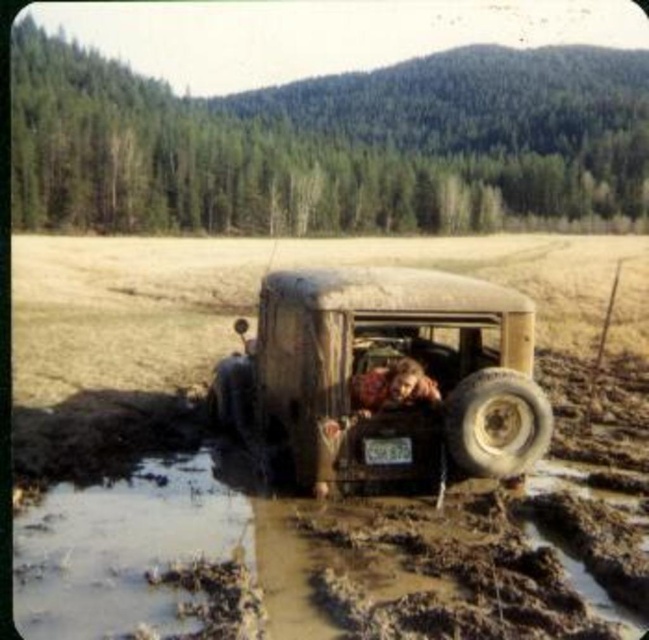
Which is above, light brown rubber tire at lower right or brown leather jacket at rear center?

brown leather jacket at rear center is above.

Find the location of a particular element. light brown rubber tire at lower right is located at coordinates (496, 422).

Between point (474, 403) and point (373, 381), which one is positioned behind?

Point (373, 381)

The width and height of the screenshot is (649, 640). In order to click on light brown rubber tire at lower right in this screenshot , I will do `click(496, 422)`.

Consider the image. Is muddy rubber truck at center positioned before brown leather jacket at rear center?

That is True.

Is point (452, 465) more distant than point (384, 381)?

No, (452, 465) is closer to viewer.

This screenshot has width=649, height=640. What do you see at coordinates (384, 378) in the screenshot?
I see `muddy rubber truck at center` at bounding box center [384, 378].

The width and height of the screenshot is (649, 640). In order to click on muddy rubber truck at center in this screenshot , I will do `click(384, 378)`.

Does muddy rubber truck at center have a larger size compared to light brown rubber tire at lower right?

Indeed, muddy rubber truck at center has a larger size compared to light brown rubber tire at lower right.

Does muddy rubber truck at center come in front of light brown rubber tire at lower right?

That is False.

Is point (313, 460) farther from camera compared to point (508, 412)?

Yes, it is.

The image size is (649, 640). In order to click on muddy rubber truck at center in this screenshot , I will do `click(384, 378)`.